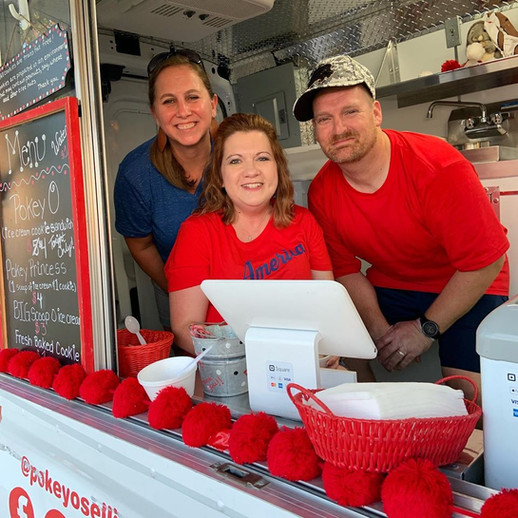
The width and height of the screenshot is (518, 518). Find the location of `faucet`. faucet is located at coordinates (454, 104).